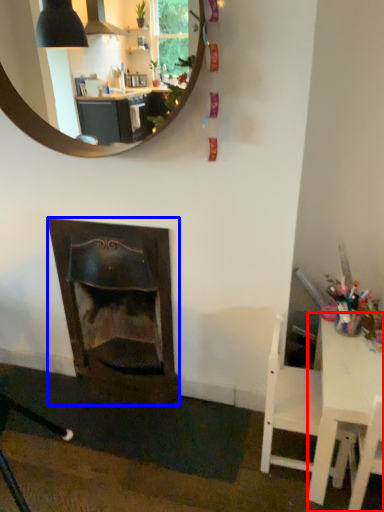
Question: Which point is closer to the camera, table (highlighted by a red box) or fireplace (highlighted by a blue box)?

Choices:
 (A) table
 (B) fireplace

Answer: (A)